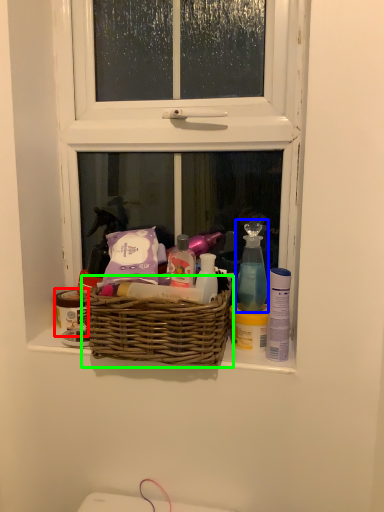
Question: Which is farther away from toiletry (highlighted by a red box)? cleaning product (highlighted by a blue box) or picnic basket (highlighted by a green box)?

Choices:
 (A) cleaning product
 (B) picnic basket

Answer: (A)